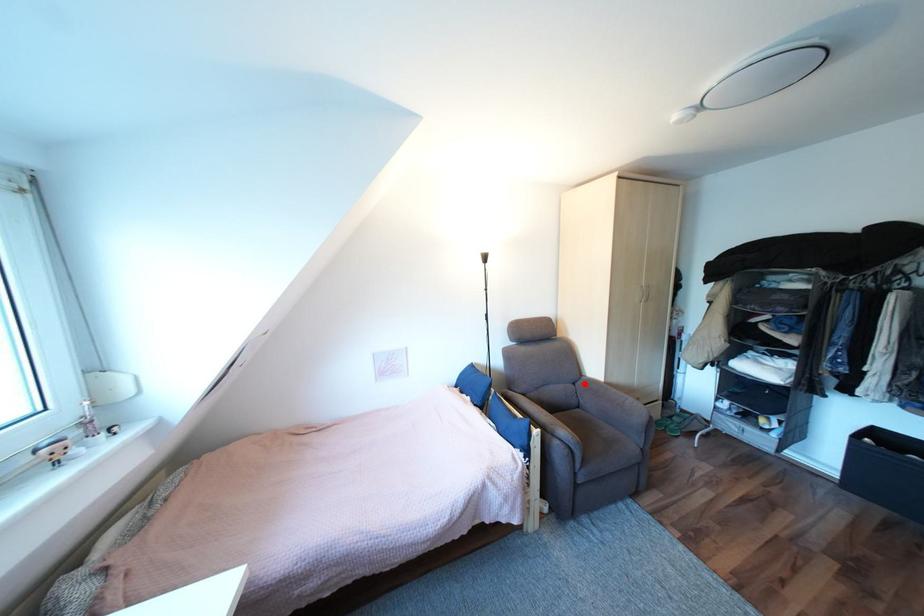
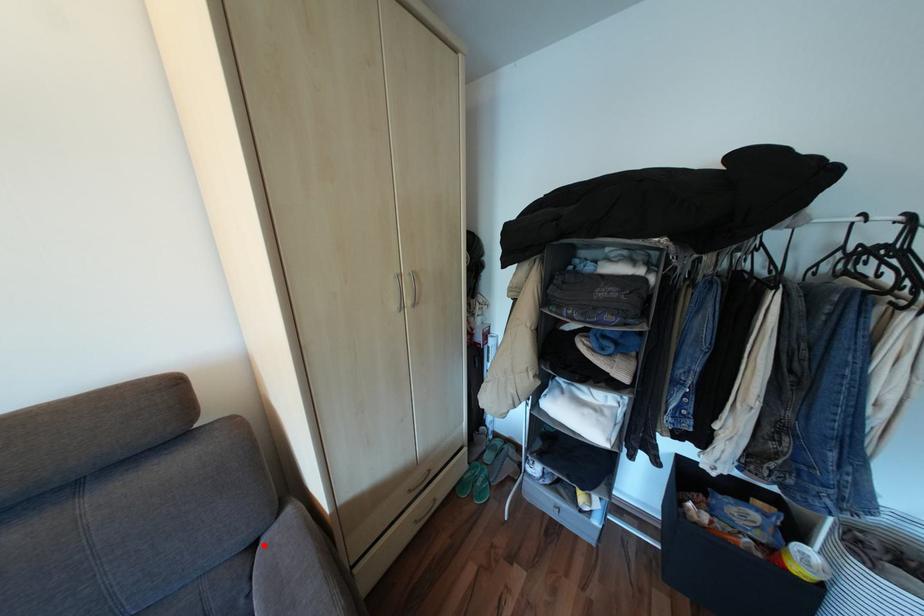
I am providing you with two images of the same scene from different viewpoints. A red point is marked on the first image and another point is marked on the second image. Is the marked point in image1 the same physical position as the marked point in image2?

Yes